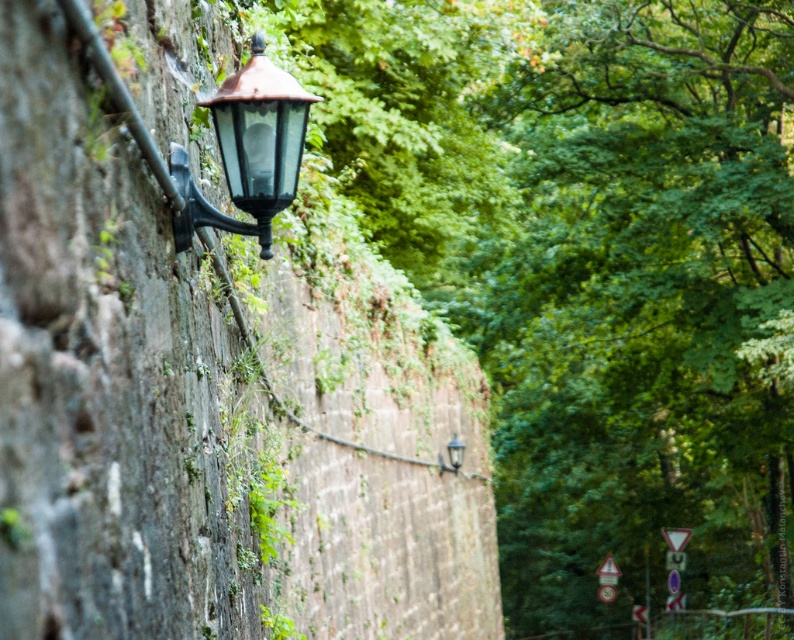
Question: Which object is the farthest from the green leafy tree at upper left?

Choices:
 (A) copper/black glass lamp at upper left
 (B) matte black lamp at upper left

Answer: (A)

Question: Which object appears farthest from the camera in this image?

Choices:
 (A) copper/black glass lamp at upper left
 (B) matte black lamp at upper left

Answer: (B)

Question: Does green leafy tree at upper left come in front of copper/black glass lamp at upper left?

Choices:
 (A) no
 (B) yes

Answer: (A)

Question: Does green leafy tree at upper left appear on the left side of copper/black glass lamp at upper left?

Choices:
 (A) yes
 (B) no

Answer: (B)

Question: Which point is closer to the camera taking this photo?

Choices:
 (A) (453, 465)
 (B) (241, 173)

Answer: (B)

Question: Does copper/black glass lamp at upper left appear on the right side of matte black lamp at upper left?

Choices:
 (A) yes
 (B) no

Answer: (B)